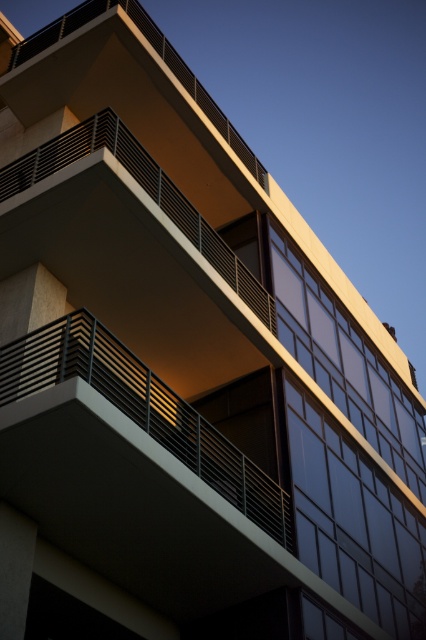
Question: Which object is farther from the camera taking this photo?

Choices:
 (A) matte black railing at upper center
 (B) metallic railings at center

Answer: (A)

Question: Is metallic railings at center further to camera compared to matte black railing at upper center?

Choices:
 (A) yes
 (B) no

Answer: (B)

Question: Which point appears closest to the camera in this image?

Choices:
 (A) (51, 145)
 (B) (65, 321)

Answer: (B)

Question: Is metallic railings at center above matte black railing at upper center?

Choices:
 (A) no
 (B) yes

Answer: (A)

Question: Observing the image, what is the correct spatial positioning of metallic railings at center in reference to matte black railing at upper center?

Choices:
 (A) below
 (B) above

Answer: (A)

Question: Which point is farther to the camera?

Choices:
 (A) (149, 429)
 (B) (45, 157)

Answer: (B)